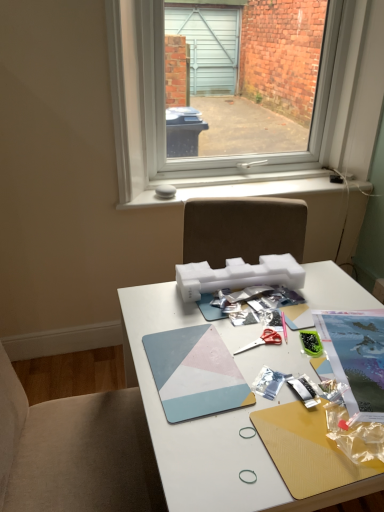
You are a GUI agent. You are given a task and a screenshot of the screen. Output one action in this format:
    pyautogui.click(x=<x>, y=<y>)
    Task: Click on the vacant space to the left of red plastic scissors at center
    
    Given the screenshot: What is the action you would take?
    pyautogui.click(x=191, y=344)